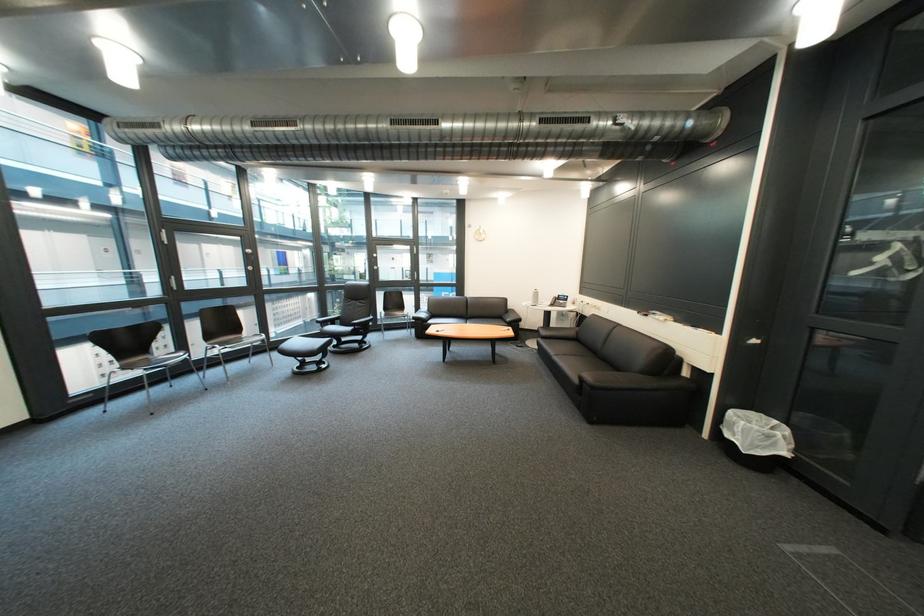
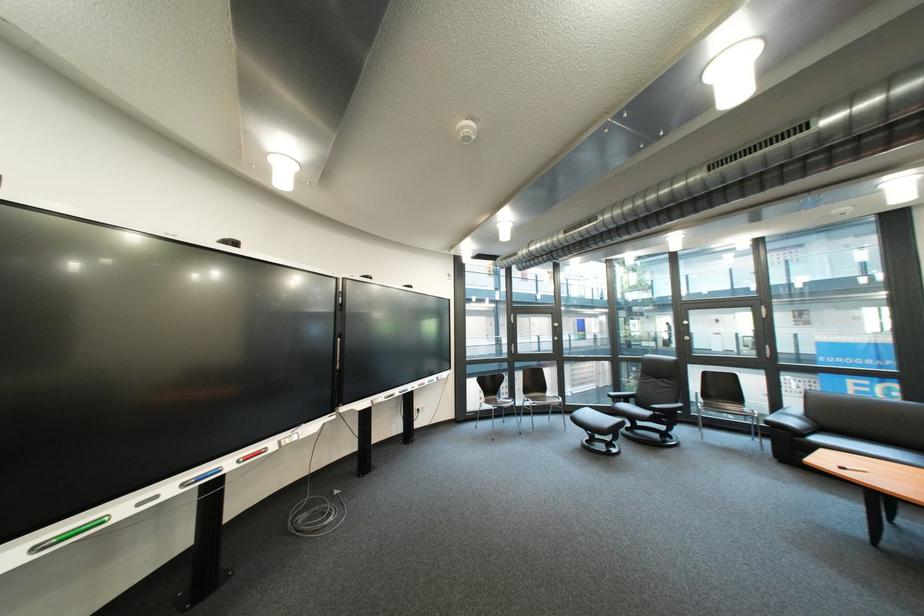
In the second image, find the point that corresponds to (x=238, y=350) in the first image.

(548, 405)